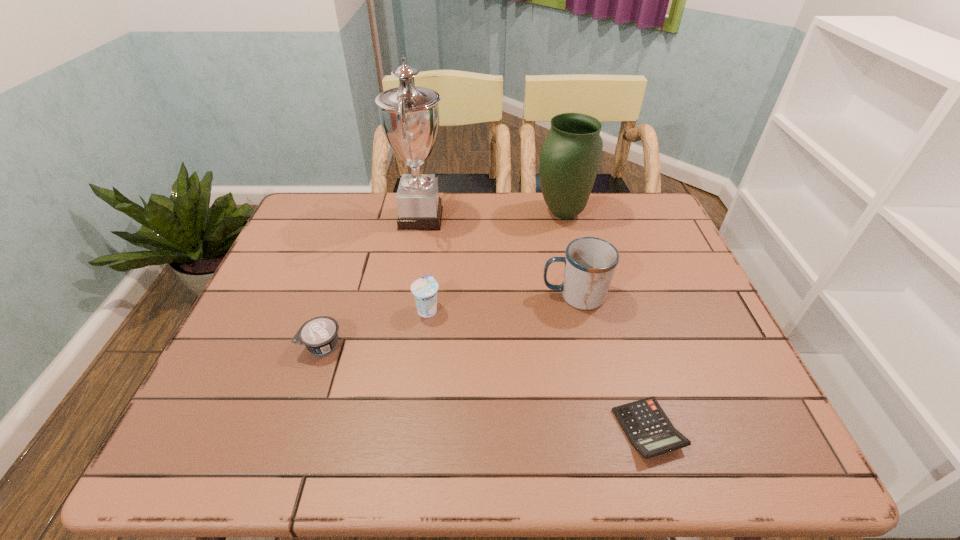
Identify the location of vacant space at the far edge of the desktop. (530, 228).

Where is `free region at the near edge`? free region at the near edge is located at coordinates (576, 437).

In the image, there is a desktop. Find the location of `free space at the left edge`. free space at the left edge is located at coordinates [x=328, y=246].

In the image, there is a desktop. At what (x,y) coordinates should I click in order to perform the action: click on vacant space at the near left corner. Please return your answer as a coordinate pair (x, y). Looking at the image, I should click on (235, 447).

Locate an element on the screen. The height and width of the screenshot is (540, 960). free region at the far right corner of the desktop is located at coordinates (614, 203).

The height and width of the screenshot is (540, 960). Identify the location of unoccupied position between the trophy cup and the vase. (492, 215).

You are a GUI agent. You are given a task and a screenshot of the screen. Output one action in this format:
    pyautogui.click(x=<x>, y=<y>)
    Task: Click on the free spot between the tallest object and the calculator
    
    Given the screenshot: What is the action you would take?
    pyautogui.click(x=535, y=324)

The image size is (960, 540). Find the location of `vacant area between the shortest object and the tallest object`. vacant area between the shortest object and the tallest object is located at coordinates (535, 324).

Image resolution: width=960 pixels, height=540 pixels. In order to click on empty location between the nearer yogurt and the farther yogurt in this screenshot , I will do coord(374,327).

Find the location of a particular element. empty space between the mug and the calculator is located at coordinates (612, 363).